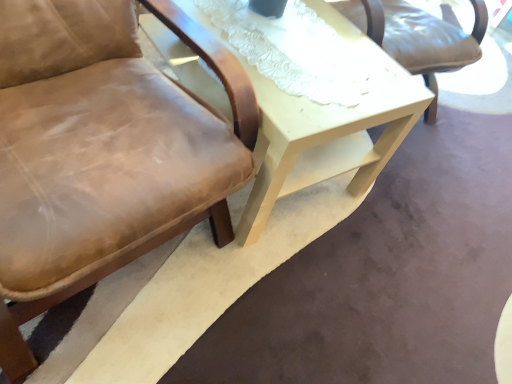
At what (x,y) coordinates should I click in order to perform the action: click on unoccupied region to the right of light beige wood table at center. Please return your answer as a coordinate pair (x, y). This screenshot has height=384, width=512. Looking at the image, I should click on (412, 245).